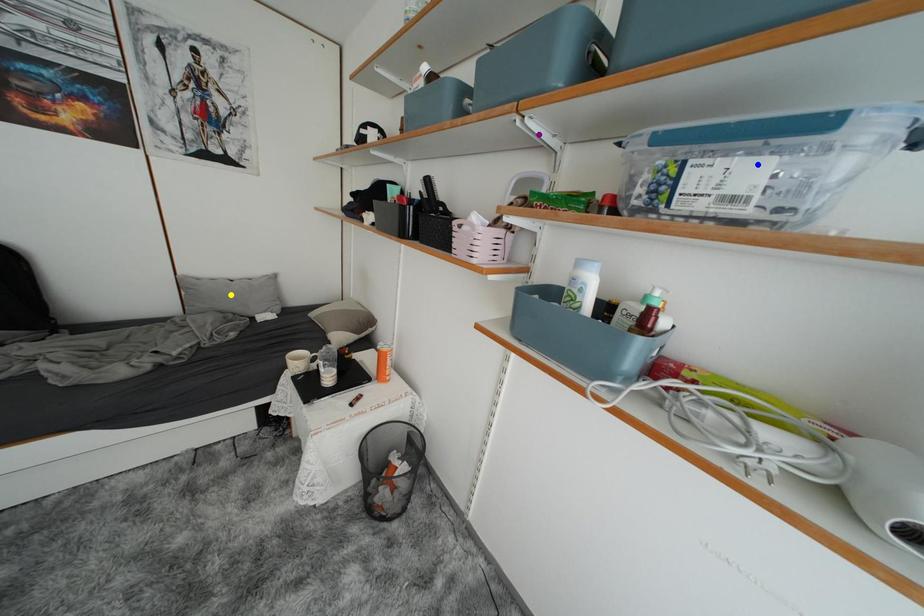
Order these from nearest to farthest:
purple point, yellow point, blue point

blue point → purple point → yellow point